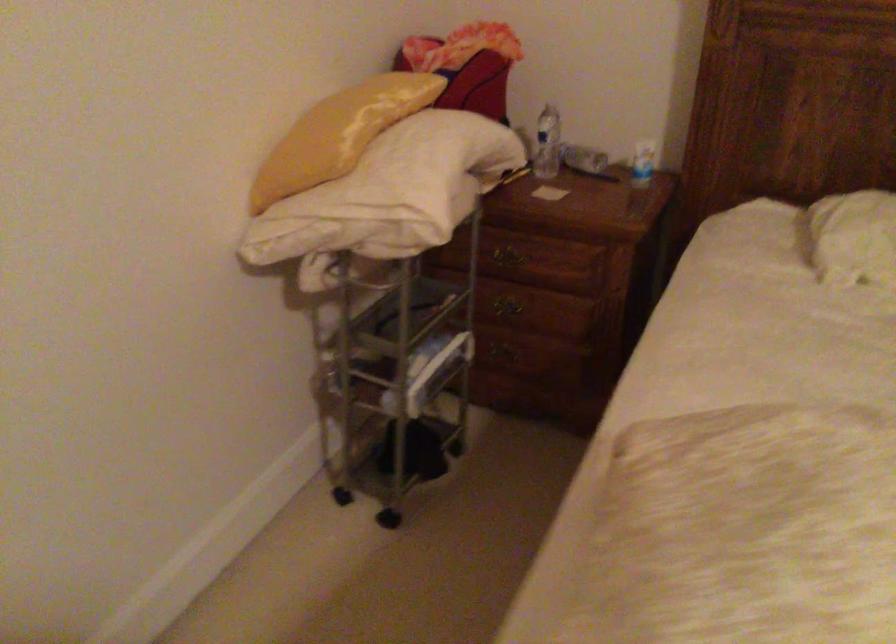
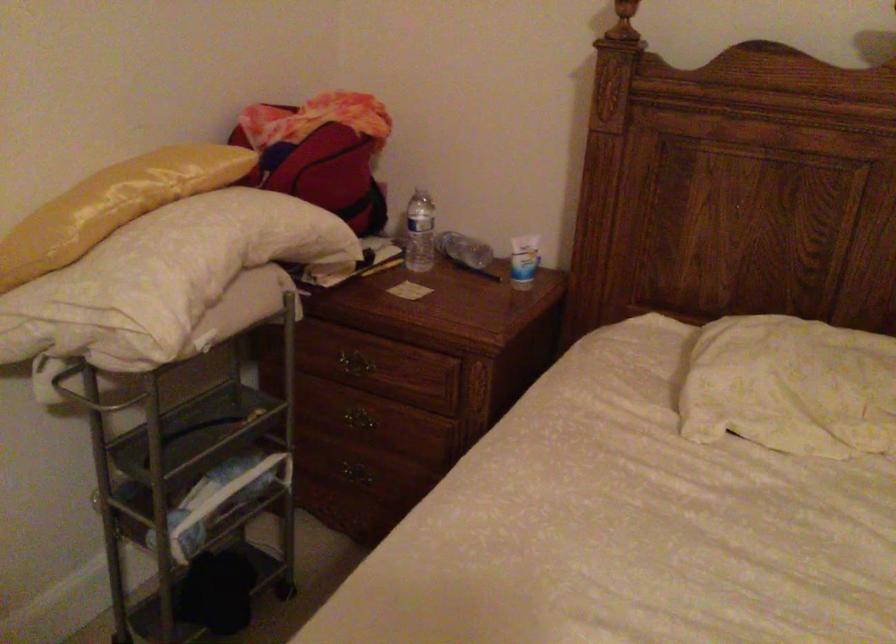
In the second image, find the point that corresponds to the point at 362,129 in the first image.

(113, 205)